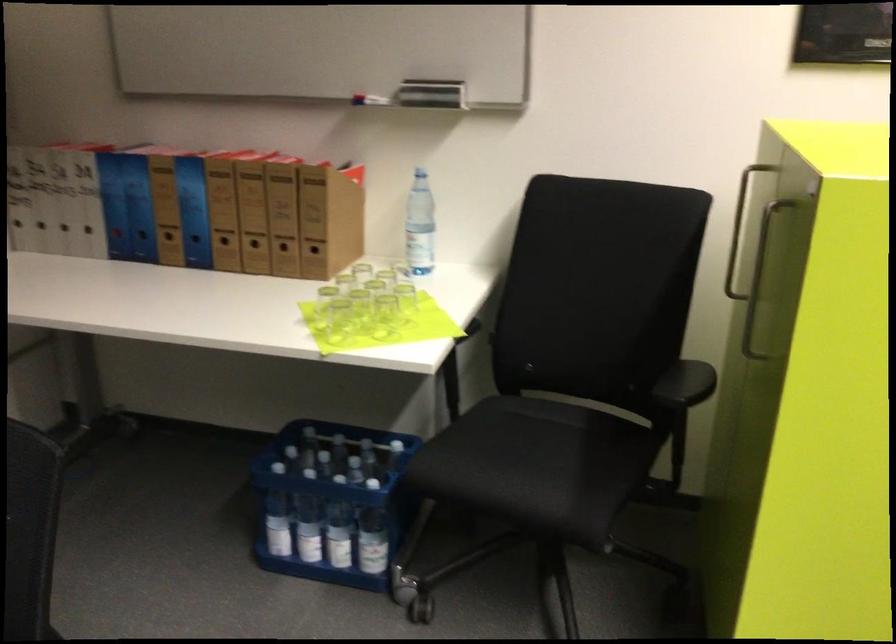
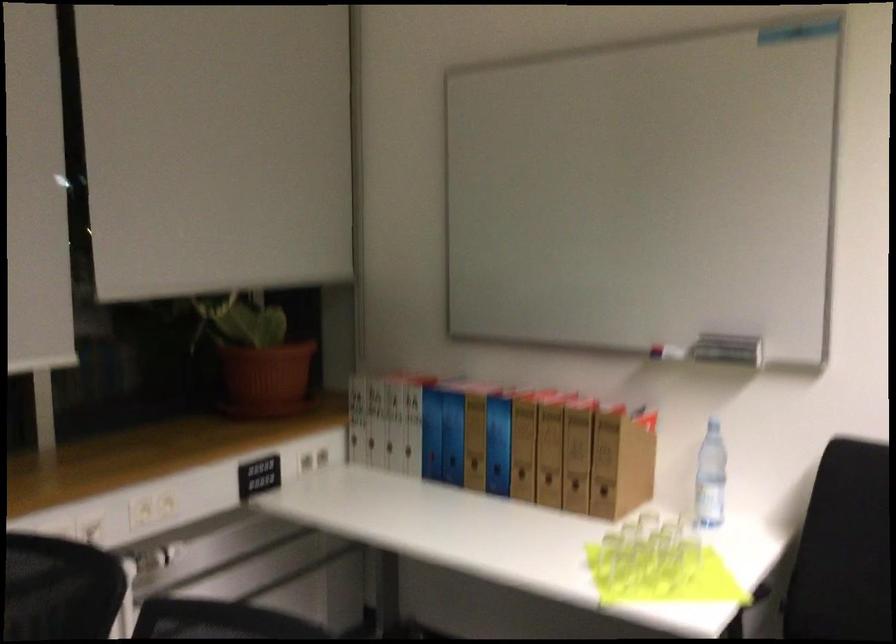
Question: The camera is either moving clockwise (left) or counter-clockwise (right) around the object. The first image is from the beginning of the video and the second image is from the end. Is the camera moving left or right when shooting the video?

Choices:
 (A) Left
 (B) Right

Answer: (B)